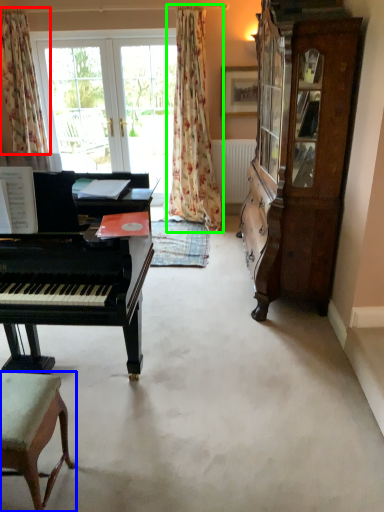
Question: Which object is the farthest from curtain (highlighted by a red box)? Choose among these: chair (highlighted by a blue box) or curtain (highlighted by a green box).

Choices:
 (A) chair
 (B) curtain

Answer: (A)